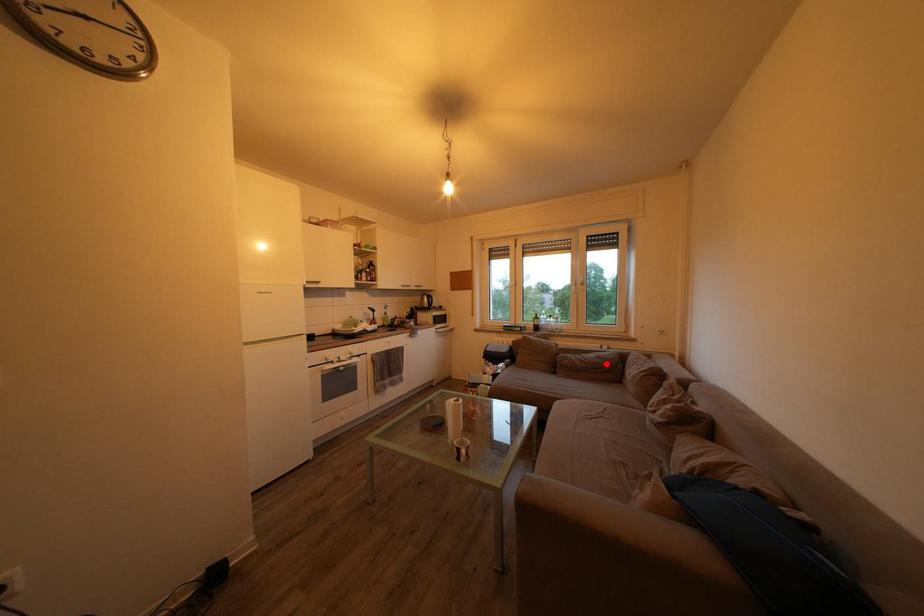
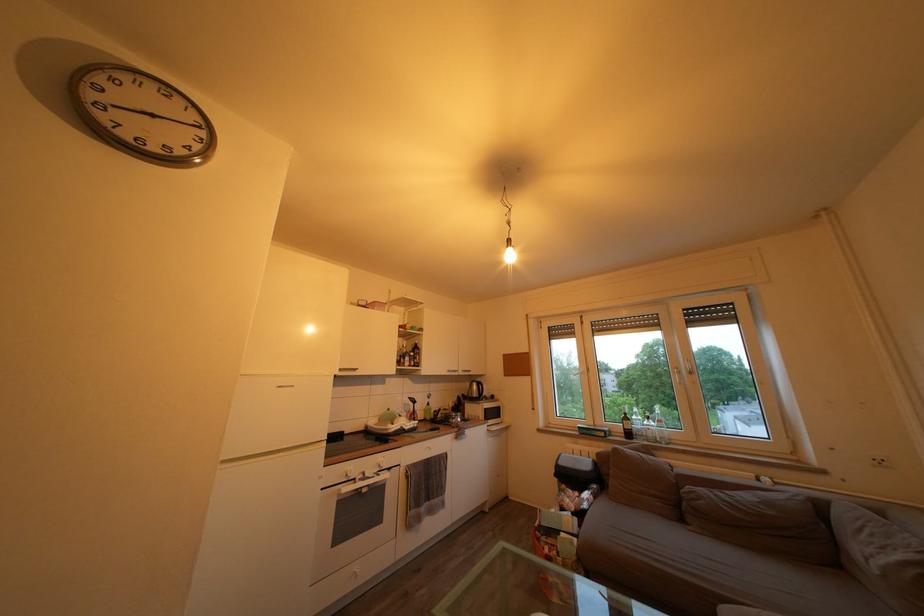
Question: I am providing you with two images of the same scene from different viewpoints. A red point is shown in image1. For the corresponding object point in image2, is it positioned nearer or farther from the camera?

Choices:
 (A) Nearer
 (B) Farther

Answer: (A)